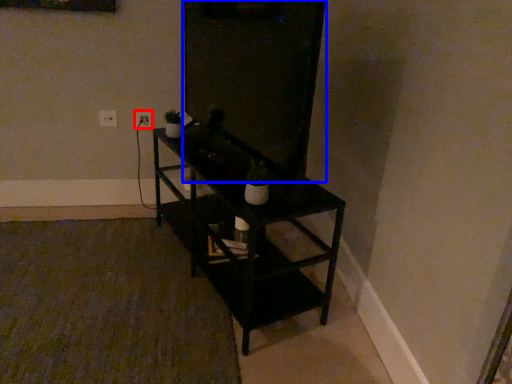
Question: Which point is closer to the camera, electric outlet (highlighted by a red box) or glass door (highlighted by a blue box)?

Choices:
 (A) electric outlet
 (B) glass door

Answer: (B)